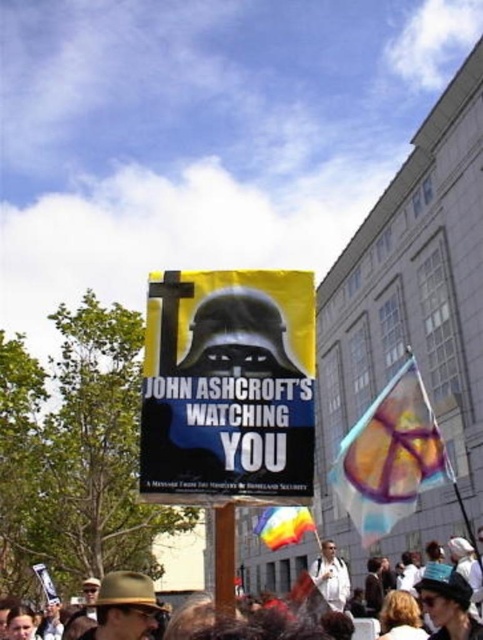
Can you confirm if yellow paper poster at center is positioned to the right of white shirt at center?

No, yellow paper poster at center is not to the right of white shirt at center.

Does yellow paper poster at center have a greater height compared to white shirt at center?

No, yellow paper poster at center is not taller than white shirt at center.

The height and width of the screenshot is (640, 483). What do you see at coordinates (228, 385) in the screenshot? I see `yellow paper poster at center` at bounding box center [228, 385].

I want to click on yellow paper poster at center, so click(x=228, y=385).

Can you confirm if yellow paper poster at center is positioned to the left of white cotton shirt at lower center?

No, yellow paper poster at center is not to the left of white cotton shirt at lower center.

Does yellow paper poster at center appear over white cotton shirt at lower center?

Yes, yellow paper poster at center is above white cotton shirt at lower center.

Between point (213, 401) and point (476, 577), which one is positioned in front?

Point (213, 401) is more forward.

Identify the location of yellow paper poster at center. This screenshot has width=483, height=640. (228, 385).

Does white cotton shirt at lower center come behind white shirt at center?

No, white cotton shirt at lower center is closer to the viewer.

Can you confirm if white cotton shirt at lower center is taller than white shirt at center?

Yes.

Image resolution: width=483 pixels, height=640 pixels. What do you see at coordinates (331, 577) in the screenshot?
I see `white cotton shirt at lower center` at bounding box center [331, 577].

Find the location of a particular element. Image resolution: width=483 pixels, height=640 pixels. white cotton shirt at lower center is located at coordinates tap(331, 577).